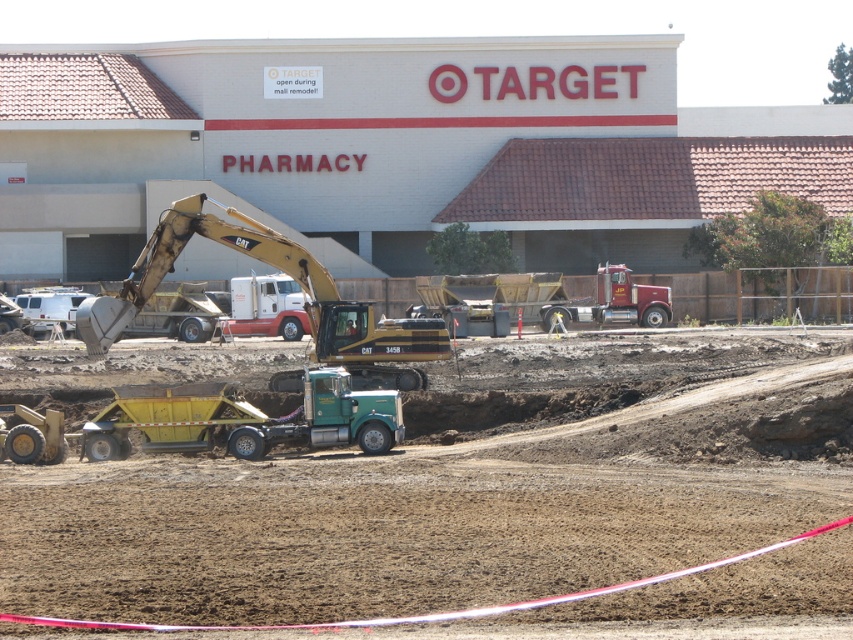
Who is positioned more to the left, brown sandy dirt at center or yellow metallic excavator at center?

Positioned to the left is yellow metallic excavator at center.

Locate an element on the screen. The width and height of the screenshot is (853, 640). brown sandy dirt at center is located at coordinates (457, 490).

Who is more distant from viewer, [633,368] or [132,282]?

The point [633,368] is more distant.

Where is `brown sandy dirt at center`? brown sandy dirt at center is located at coordinates (457, 490).

Is point (610, 349) positioned in front of point (352, 324)?

No, (610, 349) is further to viewer.

Identify the location of brown sandy dirt at center. This screenshot has width=853, height=640. point(457,490).

Looking at this image, can you confirm if brown sandy dirt at center is positioned above green metallic trailer truck at center?

Incorrect, brown sandy dirt at center is not positioned above green metallic trailer truck at center.

Between brown sandy dirt at center and green metallic trailer truck at center, which one appears on the right side from the viewer's perspective?

Positioned to the right is brown sandy dirt at center.

Does point (811, 440) come closer to viewer compared to point (360, 440)?

Yes.

Where is `brown sandy dirt at center`? This screenshot has width=853, height=640. brown sandy dirt at center is located at coordinates (457, 490).